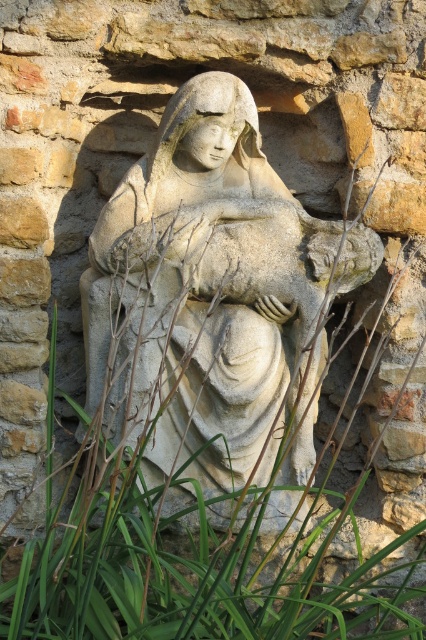
You are a photographer standing in front of the stone sculpture. You want to capture a closeup shot of the stone statue at center and the green leafy grass at center in the same frame. Can you fit both in your camera viewfinder if your camera has a minimum focus distance of 5 inches?

The stone statue at center and green leafy grass at center are 4.80 inches apart, so yes, the photographer can fit both in the camera viewfinder since the distance between them is less than the camera minimum focus distance of 5 inches.

You are standing in front of a stone wall with both the stone statue at center and the green leafy grass at center. Which object is positioned to the left?

The green leafy grass at center is to the left of the stone statue at center.

You are a gardener who needs to place a new decorative pot between the stone statue at center and the green leafy grass at center. Which object should the pot be closer to if it needs to be placed closer to the smaller one?

The stone statue at center is smaller than the green leafy grass at center, so the pot should be placed closer to the stone statue at center.